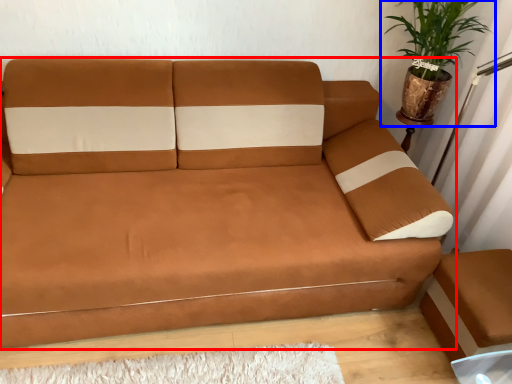
Question: Which object appears closest to the camera in this image, studio couch (highlighted by a red box) or houseplant (highlighted by a blue box)?

Choices:
 (A) studio couch
 (B) houseplant

Answer: (A)